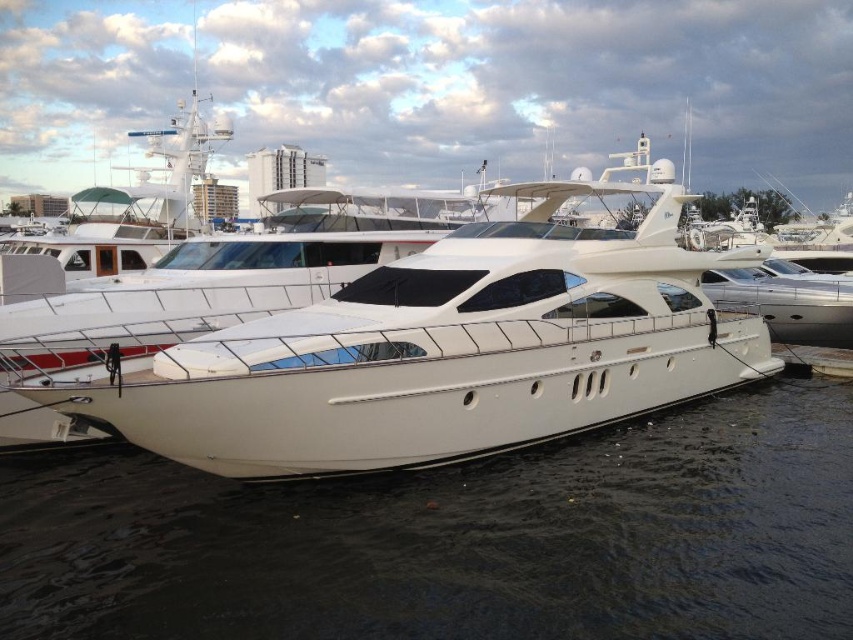
Question: Which of the following is the closest to the observer?

Choices:
 (A) white glossy water at lower center
 (B) white glossy yacht at center

Answer: (A)

Question: Can you confirm if white glossy water at lower center is wider than white glossy yacht at center?

Choices:
 (A) no
 (B) yes

Answer: (A)

Question: Can you confirm if white glossy water at lower center is positioned below white glossy yacht at center?

Choices:
 (A) no
 (B) yes

Answer: (B)

Question: Is white glossy water at lower center thinner than white glossy yacht at center?

Choices:
 (A) yes
 (B) no

Answer: (A)

Question: Which point is farther to the camera?

Choices:
 (A) white glossy water at lower center
 (B) white glossy yacht at center

Answer: (B)